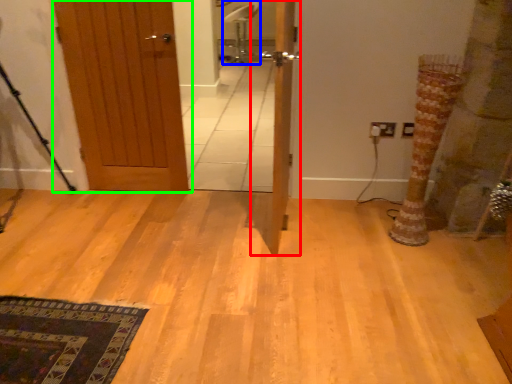
Question: Which is nearer to the door (highlighted by a red box)? chair (highlighted by a blue box) or door (highlighted by a green box).

Choices:
 (A) chair
 (B) door

Answer: (B)